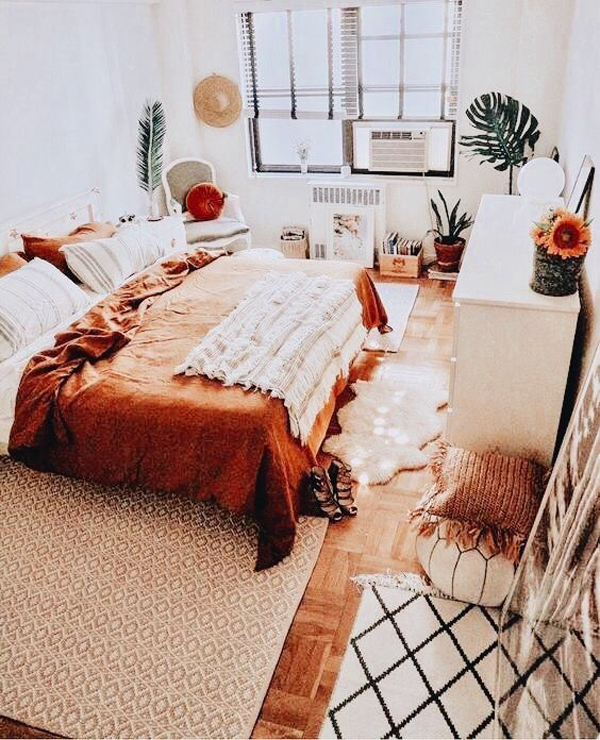
Locate an element on the screen. Image resolution: width=600 pixels, height=740 pixels. white rug is located at coordinates (428, 647).